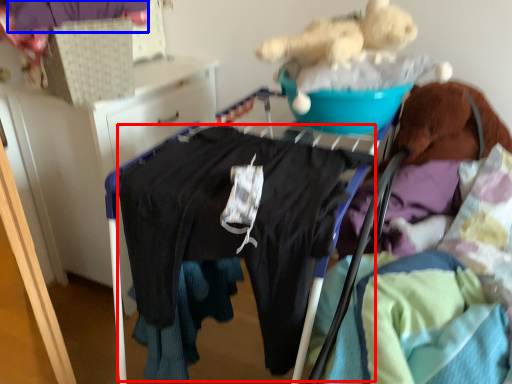
Question: Among these objects, which one is farthest to the camera, clothing (highlighted by a red box) or clothing (highlighted by a blue box)?

Choices:
 (A) clothing
 (B) clothing

Answer: (B)